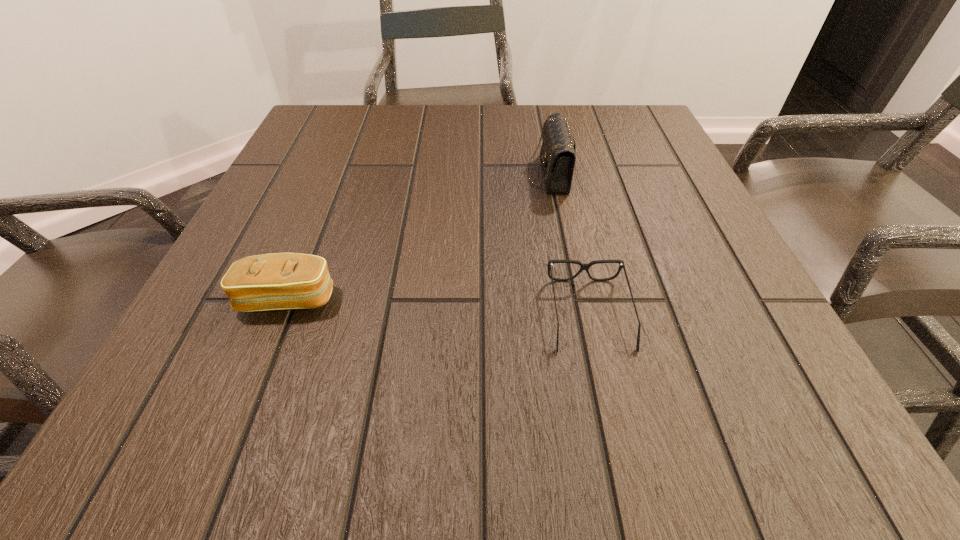
Find the location of a particular element. The height and width of the screenshot is (540, 960). free space between the farther clutch bag and the spectacles is located at coordinates (568, 244).

Identify the location of unoccupied area between the nearer clutch bag and the spectacles. This screenshot has height=540, width=960. (439, 307).

Find the location of a particular element. free spot between the spectacles and the farther clutch bag is located at coordinates (568, 244).

At what (x,y) coordinates should I click in order to perform the action: click on free point between the leftmost object and the taller clutch bag. Please return your answer as a coordinate pair (x, y). This screenshot has width=960, height=540. Looking at the image, I should click on (419, 236).

Find the location of `vacant region between the farther clutch bag and the spectacles`. vacant region between the farther clutch bag and the spectacles is located at coordinates (568, 244).

Identify the location of vacant region between the taller clutch bag and the shortest object. (568, 244).

In order to click on free space between the left clutch bag and the farthest object in this screenshot , I will do `click(419, 236)`.

The image size is (960, 540). I want to click on free space between the farther clutch bag and the shortest object, so click(568, 244).

Identify which object is the closest to the spectacles. Please provide its 2D coordinates. Your answer should be formatted as a tuple, i.e. [(x, y)], where the tuple contains the x and y coordinates of a point satisfying the conditions above.

[(558, 151)]

You are a GUI agent. You are given a task and a screenshot of the screen. Output one action in this format:
    pyautogui.click(x=<x>, y=<y>)
    Task: Click on the closest object to the shortest object
    The image size is (960, 540).
    Given the screenshot: What is the action you would take?
    pyautogui.click(x=558, y=151)